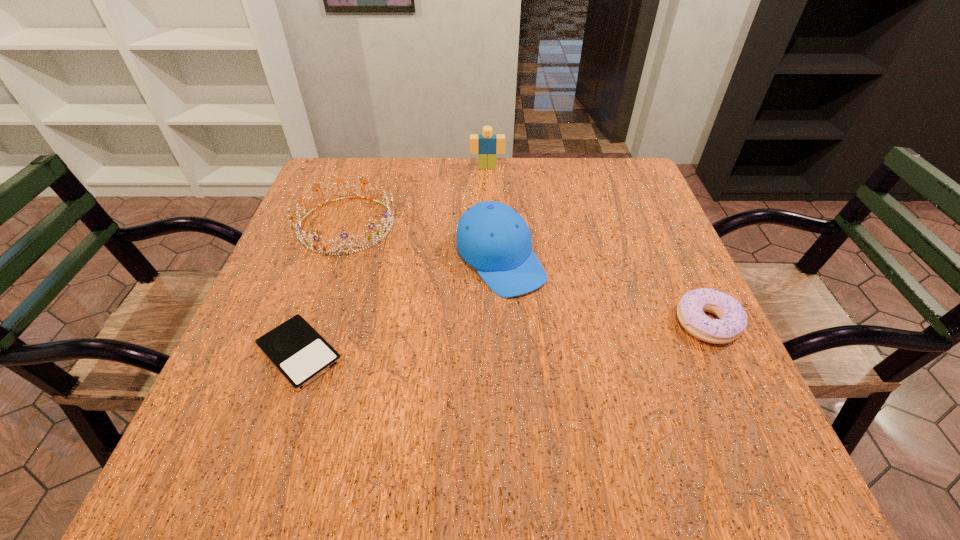
This screenshot has height=540, width=960. I want to click on free spot on the desktop that is between the iPod and the rightmost object and is positioned on the front-facing side of the third shortest object, so click(492, 339).

At what (x,y) coordinates should I click in order to perform the action: click on vacant space on the desktop that is between the iPod and the doughnut and is positioned on the front-facing side of the cap. Please return your answer as a coordinate pair (x, y). This screenshot has width=960, height=540. Looking at the image, I should click on (564, 334).

Identify the location of free spot on the desktop that is between the shortest object and the second shortest object and is positioned on the face of the Lego. (497, 339).